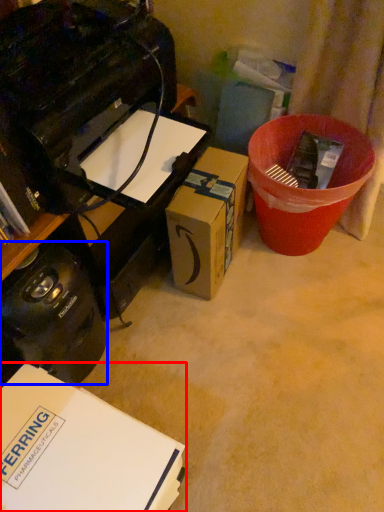
Question: Which object is closer to the camera taking this photo, box (highlighted by a red box) or appliance (highlighted by a blue box)?

Choices:
 (A) box
 (B) appliance

Answer: (A)